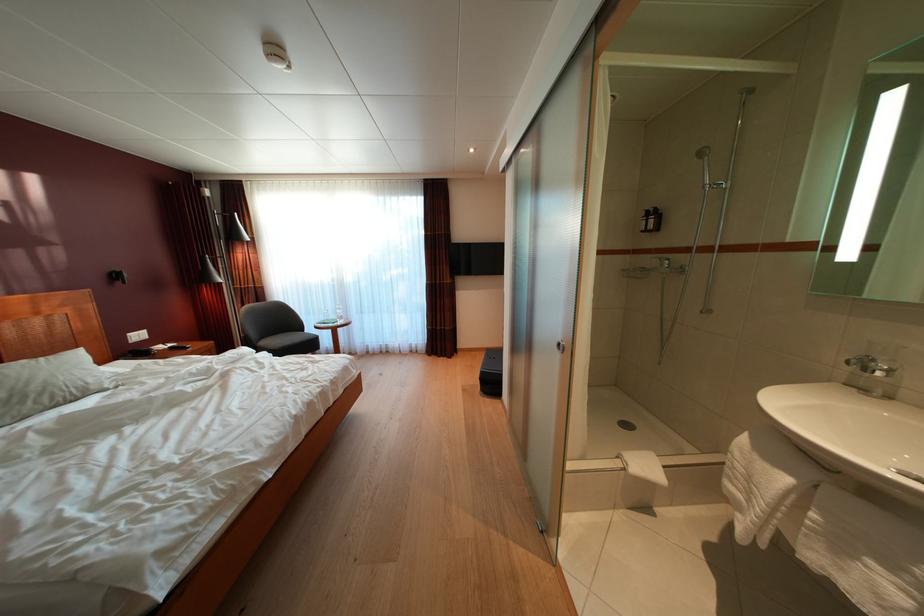
The image size is (924, 616). What do you see at coordinates (47, 383) in the screenshot? I see `a grey pillow` at bounding box center [47, 383].